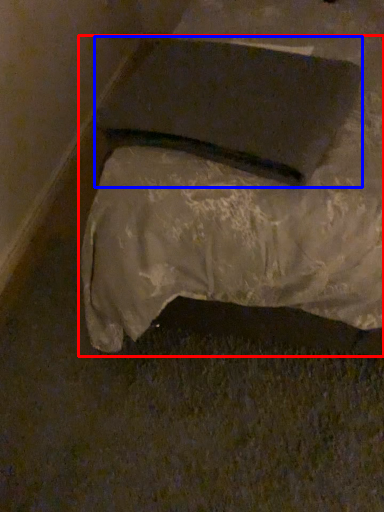
Question: Which object is further to the camera taking this photo, furniture (highlighted by a red box) or pad (highlighted by a blue box)?

Choices:
 (A) furniture
 (B) pad

Answer: (B)